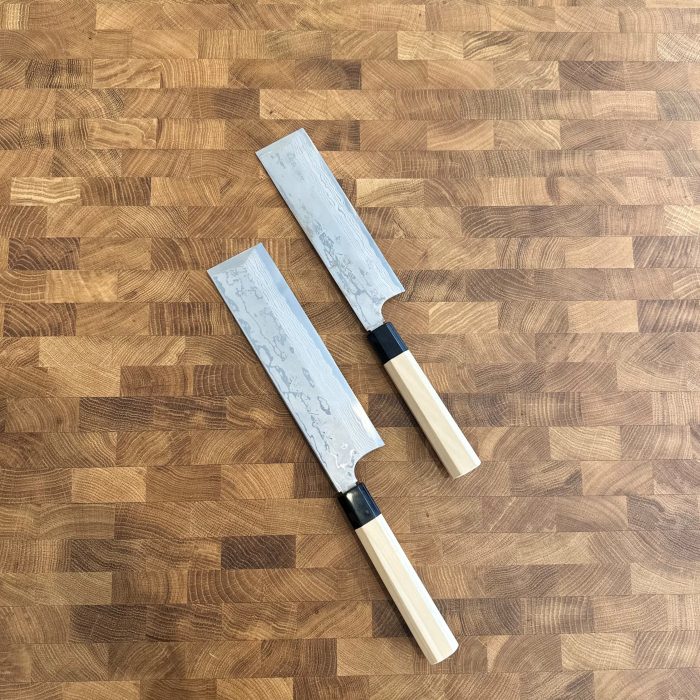
You are a GUI agent. You are given a task and a screenshot of the screen. Output one action in this format:
    pyautogui.click(x=<x>, y=<y>)
    Task: Click on the bolsters
    
    Given the screenshot: What is the action you would take?
    pyautogui.click(x=358, y=512), pyautogui.click(x=385, y=346)